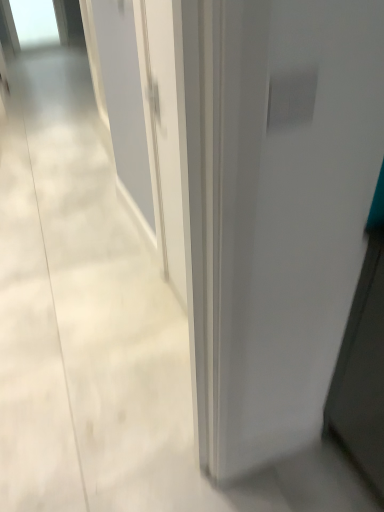
Where is `vacant space situated on the left part of white glossy door at center`? This screenshot has width=384, height=512. vacant space situated on the left part of white glossy door at center is located at coordinates (115, 302).